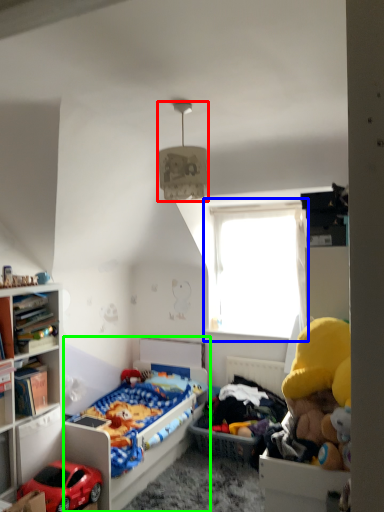
Question: Considering the real-world distances, which object is closest to lamp (highlighted by a red box)? window (highlighted by a blue box) or bed (highlighted by a green box).

Choices:
 (A) window
 (B) bed

Answer: (B)